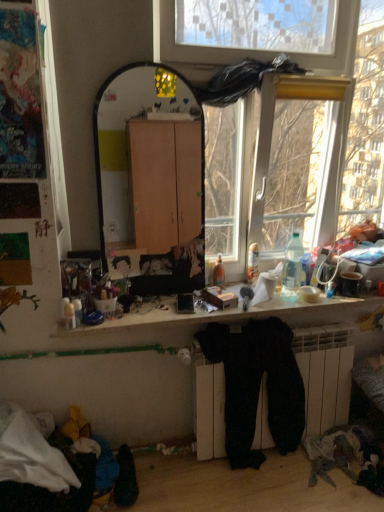
The height and width of the screenshot is (512, 384). I want to click on free space above black velvet pants at lower center (from a real-world perspective), so click(x=250, y=320).